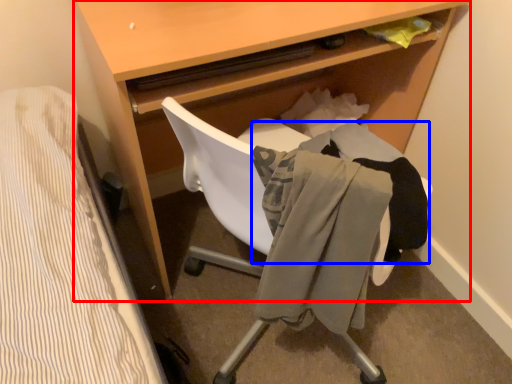
Question: Which of the following is the closest to the observer, desk (highlighted by a red box) or clothing (highlighted by a blue box)?

Choices:
 (A) desk
 (B) clothing

Answer: (A)